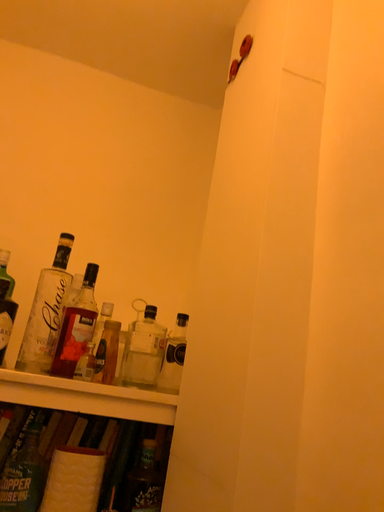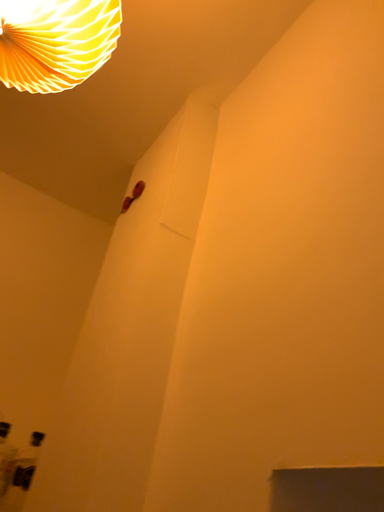
Question: How did the camera likely rotate when shooting the video?

Choices:
 (A) rotated left
 (B) rotated right

Answer: (B)